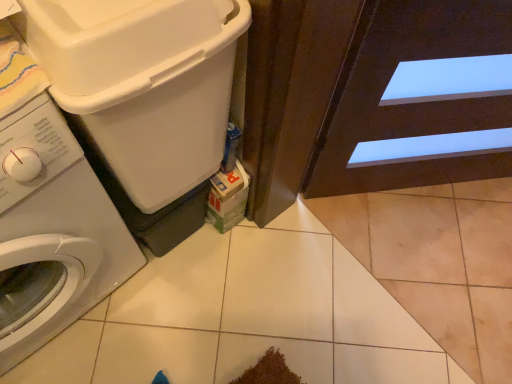
Question: Is white glossy washing machine at left, placed as the 1th washing machine when sorted from left to right, positioned with its back to white plastic washing machine at left, the 1th washing machine viewed from the right?

Choices:
 (A) yes
 (B) no

Answer: (B)

Question: Is white glossy washing machine at left, which is the second washing machine in right-to-left order, to the left of white plastic washing machine at left, the 1th washing machine viewed from the right, from the viewer's perspective?

Choices:
 (A) yes
 (B) no

Answer: (A)

Question: Is white glossy washing machine at left, placed as the 1th washing machine when sorted from left to right, far from white plastic washing machine at left, the 2th washing machine when ordered from left to right?

Choices:
 (A) yes
 (B) no

Answer: (B)

Question: Is white glossy washing machine at left, placed as the 1th washing machine when sorted from left to right, to the right of white plastic washing machine at left, the 1th washing machine viewed from the right, from the viewer's perspective?

Choices:
 (A) no
 (B) yes

Answer: (A)

Question: From the image's perspective, is white glossy washing machine at left, which is the second washing machine in right-to-left order, above white plastic washing machine at left, the 1th washing machine viewed from the right?

Choices:
 (A) yes
 (B) no

Answer: (B)

Question: Does white glossy washing machine at left, placed as the 1th washing machine when sorted from left to right, have a lesser height compared to white plastic washing machine at left, the 1th washing machine viewed from the right?

Choices:
 (A) no
 (B) yes

Answer: (A)

Question: Does white plastic washing machine at left, the 2th washing machine when ordered from left to right, have a greater height compared to white glossy washing machine at left, which is the second washing machine in right-to-left order?

Choices:
 (A) no
 (B) yes

Answer: (A)

Question: Could you tell me if white plastic washing machine at left, the 2th washing machine when ordered from left to right, is turned towards white glossy washing machine at left, which is the second washing machine in right-to-left order?

Choices:
 (A) yes
 (B) no

Answer: (B)

Question: Does white plastic washing machine at left, the 1th washing machine viewed from the right, have a smaller size compared to white glossy washing machine at left, placed as the 1th washing machine when sorted from left to right?

Choices:
 (A) yes
 (B) no

Answer: (A)

Question: Is the position of white plastic washing machine at left, the 1th washing machine viewed from the right, less distant than that of white glossy washing machine at left, placed as the 1th washing machine when sorted from left to right?

Choices:
 (A) no
 (B) yes

Answer: (A)

Question: Is white plastic washing machine at left, the 2th washing machine when ordered from left to right, far away from white glossy washing machine at left, which is the second washing machine in right-to-left order?

Choices:
 (A) yes
 (B) no

Answer: (B)

Question: From a real-world perspective, is white plastic washing machine at left, the 2th washing machine when ordered from left to right, under white glossy washing machine at left, which is the second washing machine in right-to-left order?

Choices:
 (A) yes
 (B) no

Answer: (B)

Question: Considering their positions, is white plastic washing machine at left, the 2th washing machine when ordered from left to right, located in front of or behind white glossy washing machine at left, which is the second washing machine in right-to-left order?

Choices:
 (A) front
 (B) behind

Answer: (B)